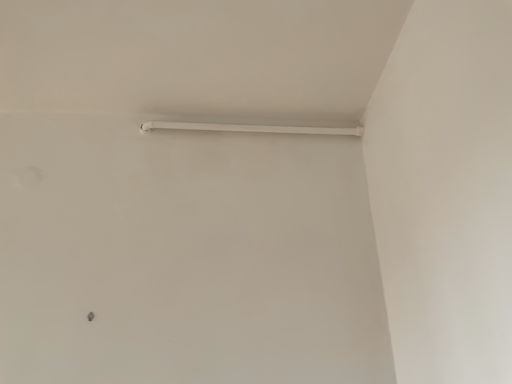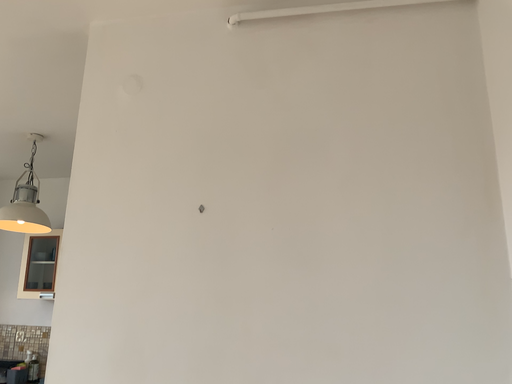
Question: How did the camera likely rotate when shooting the video?

Choices:
 (A) rotated downward
 (B) rotated upward

Answer: (A)